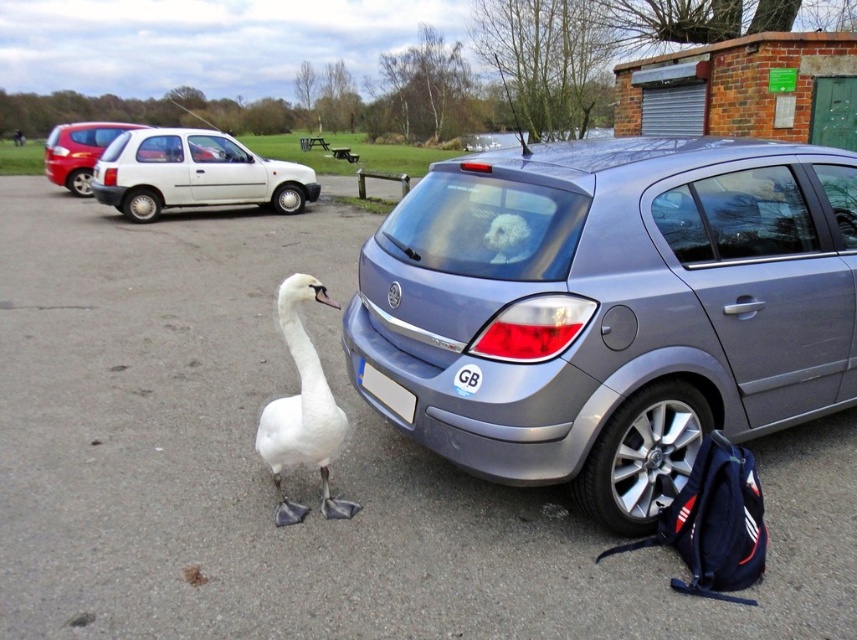
You are a parking attendant checking the parking lot. You see two cars parked at the left side of the parking area. Which car has a smaller width between the white matte hatchback at left and the matte red hatchback at left?

The white matte hatchback at left has a smaller width compared to the matte red hatchback at left, as stated in the description.

You are standing at the parking area near the water where the white swan is. You want to walk to the point marked at coordinates (141, 218). How far will you have to walk?

The point at coordinates (141, 218) is 13.23 meters away from the viewer, so you will have to walk 13.23 meters to reach it.